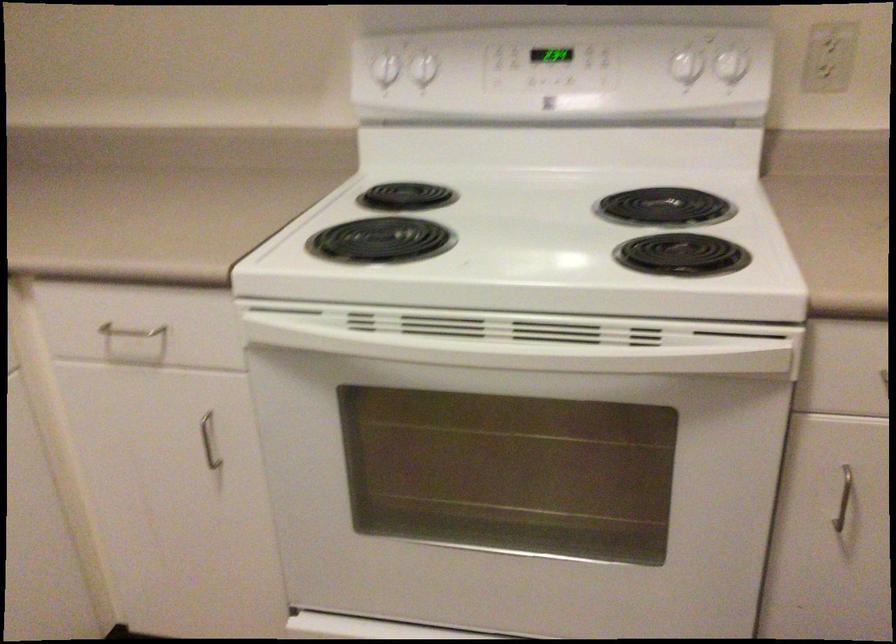
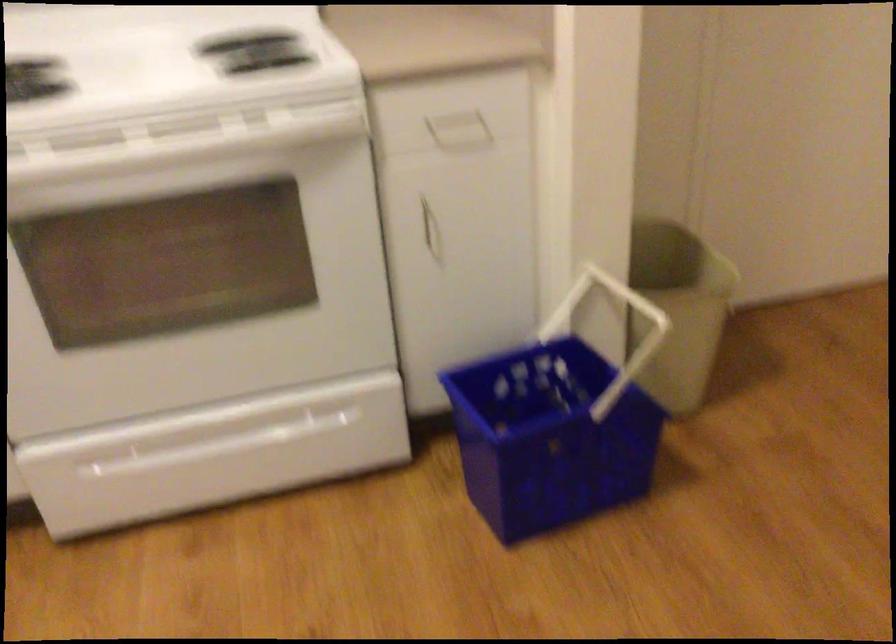
Question: How did the camera likely rotate?

Choices:
 (A) Left
 (B) Right
 (C) Up
 (D) Down

Answer: (B)